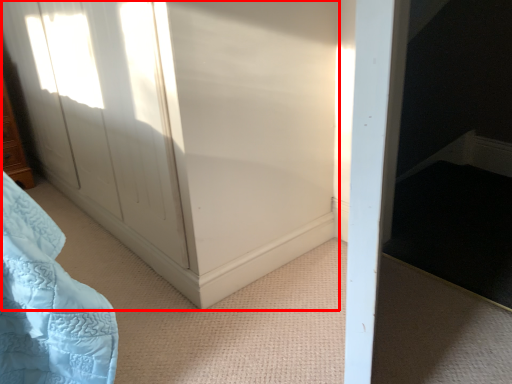
Question: From the image's perspective, where is screen door (annotated by the red box) located relative to furniture?

Choices:
 (A) above
 (B) below

Answer: (A)